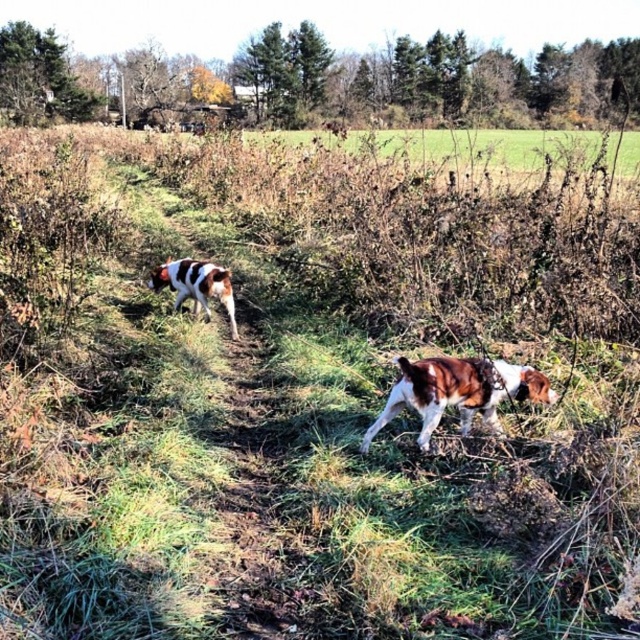
Is brown and white fur at center taller than brown and white speckled dog at left?

No, brown and white fur at center is not taller than brown and white speckled dog at left.

Is the position of brown and white fur at center less distant than that of brown and white speckled dog at left?

Yes.

Identify the location of brown and white fur at center. This screenshot has height=640, width=640. (458, 392).